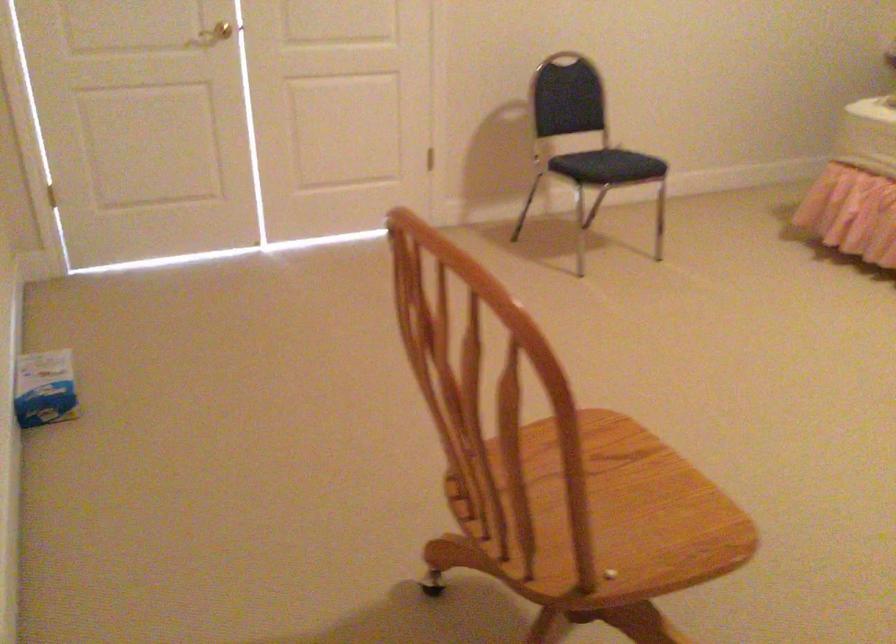
The height and width of the screenshot is (644, 896). I want to click on wooden chair sitting surface, so click(x=613, y=509).